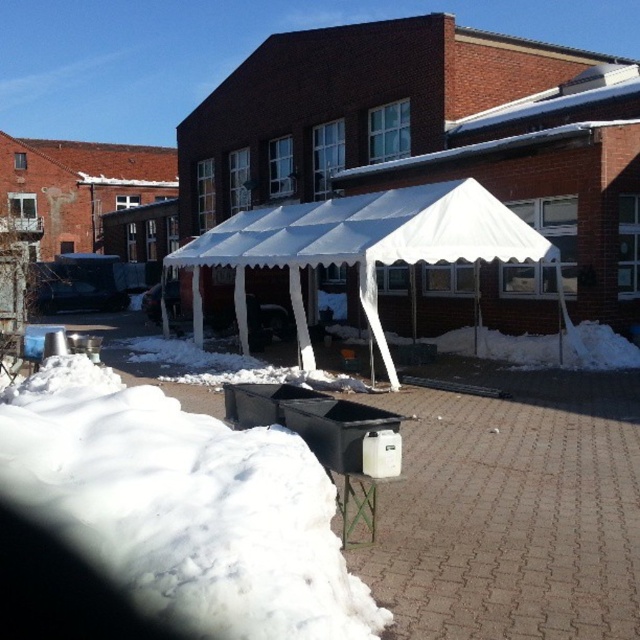
You are planning to set up a small tent in the winter scene. You have two options for placement locations based on the available space. The first option is near the white fluffy snow at lower left, and the second is under the white fabric canopy at center. Which location offers more horizontal space for your tent?

The white fabric canopy at center offers more horizontal space because its width is greater than the white fluffy snow at lower left.